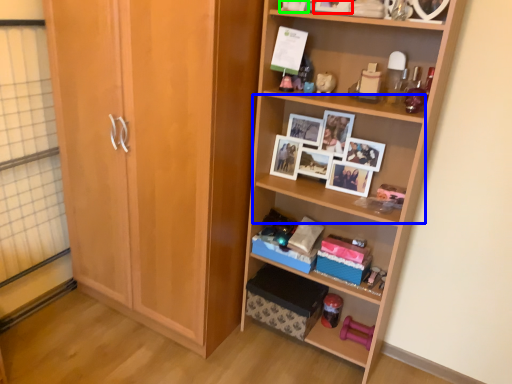
Question: Which object is positioned closest to picture frame (highlighted by a red box)? Select from shelf (highlighted by a blue box) and toy (highlighted by a green box).

Choices:
 (A) shelf
 (B) toy

Answer: (B)